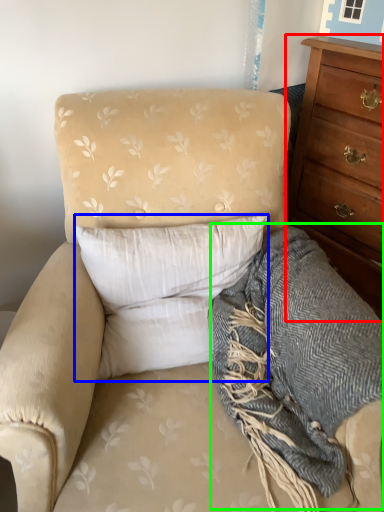
Question: Which object is the closest to the chest of drawers (highlighted by a red box)? Choose among these: pillow (highlighted by a blue box) or blanket (highlighted by a green box).

Choices:
 (A) pillow
 (B) blanket

Answer: (B)